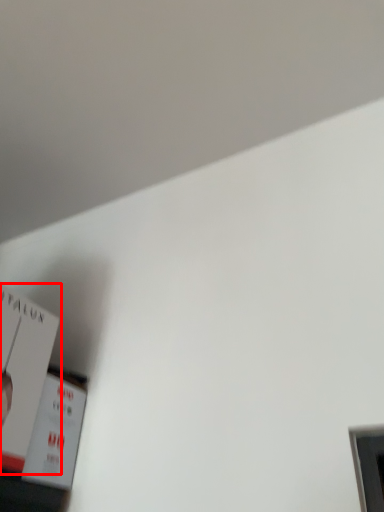
Question: Where is paperback book (annotated by the red box) located in relation to paperback book in the image?

Choices:
 (A) left
 (B) right

Answer: (A)